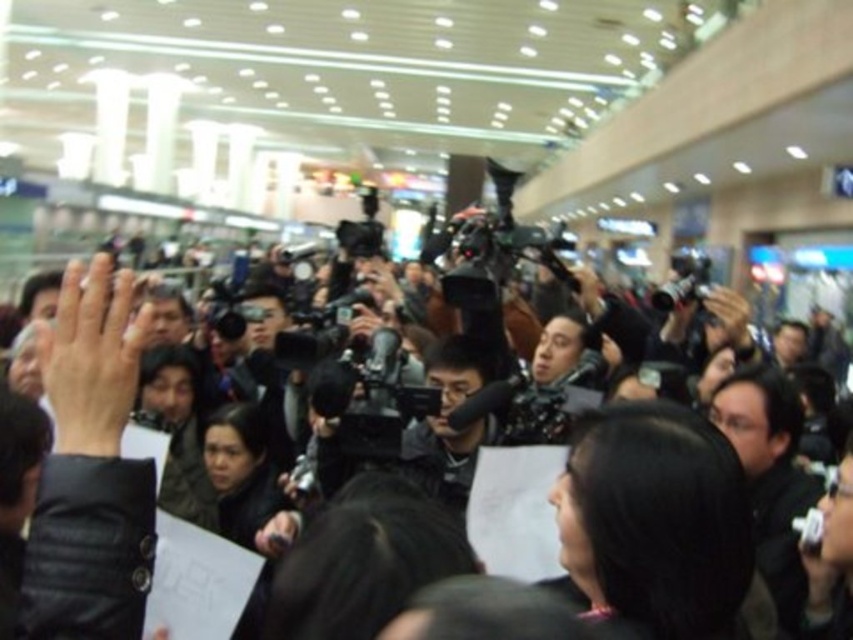
You are a photographer at the event and need to determine which camera is shorter. You have a black matte camera at center and a black plastic video camera at center in front of you. Which one is shorter?

The black matte camera at center is not as tall as the black plastic video camera at center, so the black matte camera at center is shorter.

You are a photographer at the event and need to adjust the height of your equipment. You have a black matte camera at center and a black plastic video camera at center. Which one is positioned lower?

The black matte camera at center is located below the black plastic video camera at center, so it is positioned lower.

You are a photographer at the event and need to position yourself to capture both the black matte camera at center and the black plastic video camera at center in your shot. Which camera should you adjust your angle to focus on first if you want to include both in your frame?

You should focus on the black matte camera at center first since it is positioned to the left of the black plastic video camera at center, allowing you to adjust your angle to include both in the frame by starting from the left side.